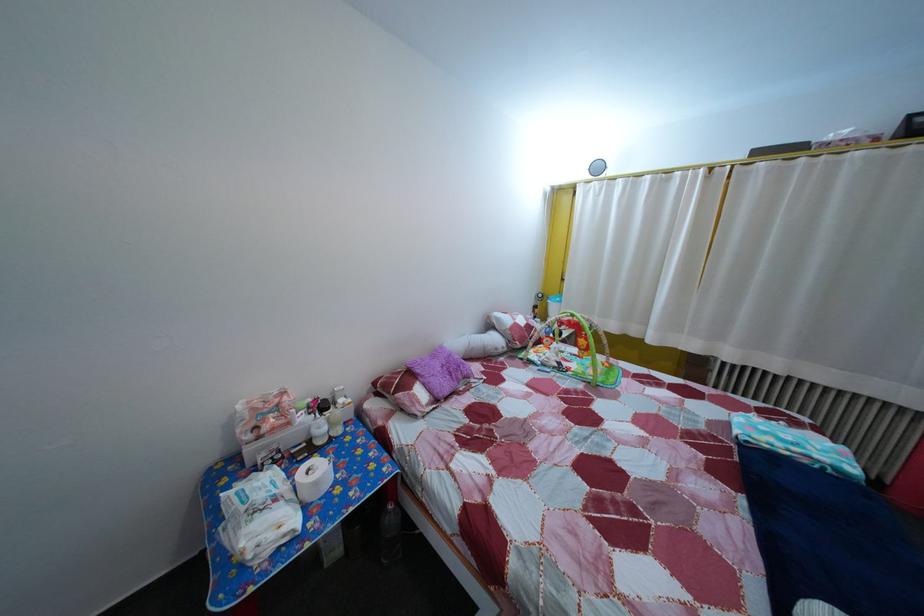
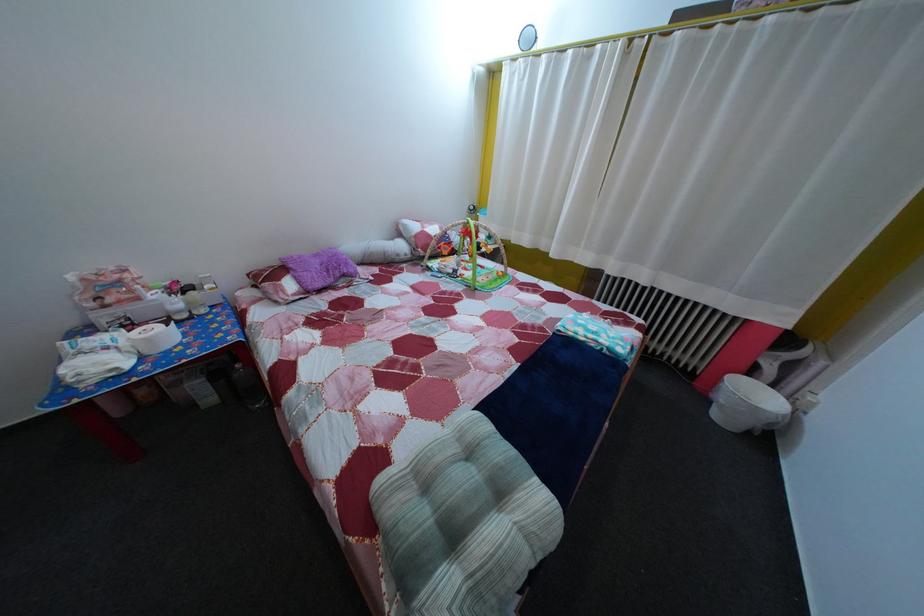
Question: The images are taken continuously from a first-person perspective. In which direction is your viewpoint rotating?

Choices:
 (A) Left
 (B) Right
 (C) Up
 (D) Down

Answer: (D)